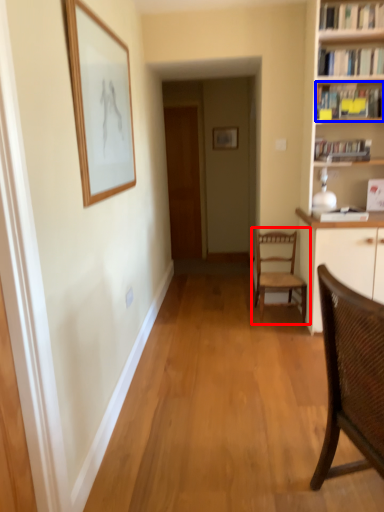
Question: Which of the following is the closest to the observer, chair (highlighted by a red box) or book (highlighted by a blue box)?

Choices:
 (A) chair
 (B) book

Answer: (B)